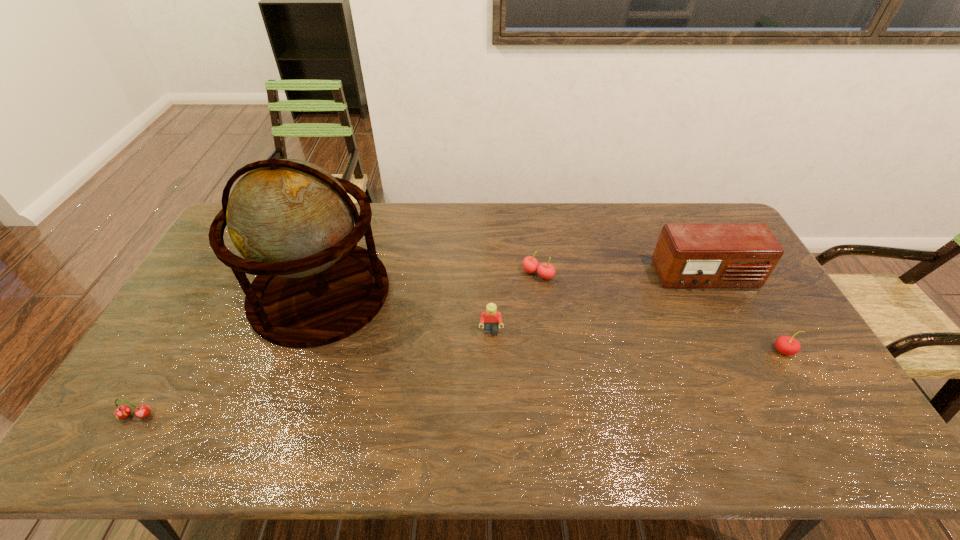
This screenshot has width=960, height=540. Identify the location of vacant space at the left edge of the desktop. (207, 319).

Where is `vacant area at the far left corner of the desktop`? Image resolution: width=960 pixels, height=540 pixels. vacant area at the far left corner of the desktop is located at coordinates (230, 240).

Identify the location of free space between the nearest object and the second object from left to right. (228, 354).

I want to click on free area in between the second nearest cherry and the second tallest object, so click(x=745, y=314).

I want to click on vacant space that's between the radio receiver and the rightmost cherry, so click(745, 314).

Find the location of `unoccupied area between the radio receiver and the Lego`. unoccupied area between the radio receiver and the Lego is located at coordinates click(x=598, y=304).

Identify the location of free spot between the second cherry from left to right and the Lego. (515, 303).

You are a GUI agent. You are given a task and a screenshot of the screen. Output one action in this format:
    pyautogui.click(x=<x>, y=<y>)
    Task: Click on the vacant point located between the second nearest cherry and the fifth shortest object
    The height and width of the screenshot is (540, 960).
    Given the screenshot: What is the action you would take?
    pyautogui.click(x=745, y=314)

Where is `free point between the Lego and the second farthest cherry`? free point between the Lego and the second farthest cherry is located at coordinates (637, 341).

Image resolution: width=960 pixels, height=540 pixels. Find the location of `vacant area that lies between the rightmost cherry and the farthest cherry`. vacant area that lies between the rightmost cherry and the farthest cherry is located at coordinates (660, 312).